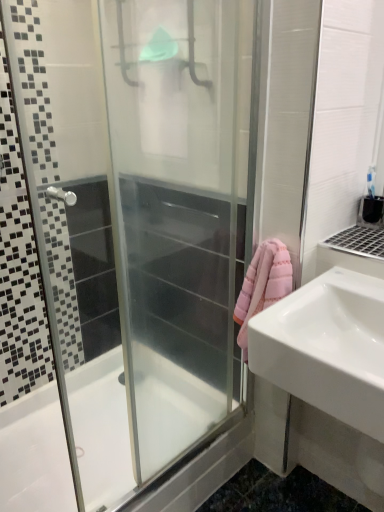
Question: From the image's perspective, is white glossy bathtub at lower left on white glossy sink at right?

Choices:
 (A) no
 (B) yes

Answer: (A)

Question: Is white glossy bathtub at lower left to the right of white glossy sink at right from the viewer's perspective?

Choices:
 (A) no
 (B) yes

Answer: (A)

Question: From the image's perspective, is white glossy bathtub at lower left below white glossy sink at right?

Choices:
 (A) yes
 (B) no

Answer: (A)

Question: From a real-world perspective, is white glossy bathtub at lower left over white glossy sink at right?

Choices:
 (A) no
 (B) yes

Answer: (A)

Question: Is white glossy bathtub at lower left bigger than white glossy sink at right?

Choices:
 (A) yes
 (B) no

Answer: (A)

Question: From a real-world perspective, is white glossy bathtub at lower left below white glossy sink at right?

Choices:
 (A) no
 (B) yes

Answer: (B)

Question: Can you confirm if white glossy sink at right is bigger than white glossy bathtub at lower left?

Choices:
 (A) yes
 (B) no

Answer: (B)

Question: Is white glossy sink at right taller than white glossy bathtub at lower left?

Choices:
 (A) yes
 (B) no

Answer: (A)

Question: From a real-world perspective, is white glossy sink at right on white glossy bathtub at lower left?

Choices:
 (A) no
 (B) yes

Answer: (B)

Question: Does white glossy sink at right have a lesser height compared to white glossy bathtub at lower left?

Choices:
 (A) no
 (B) yes

Answer: (A)

Question: Does white glossy sink at right appear on the left side of white glossy bathtub at lower left?

Choices:
 (A) yes
 (B) no

Answer: (B)

Question: Is white glossy sink at right placed right next to white glossy bathtub at lower left?

Choices:
 (A) no
 (B) yes

Answer: (A)

Question: From a real-world perspective, is white glossy sink at right over transparent glass shower door at center?

Choices:
 (A) yes
 (B) no

Answer: (B)